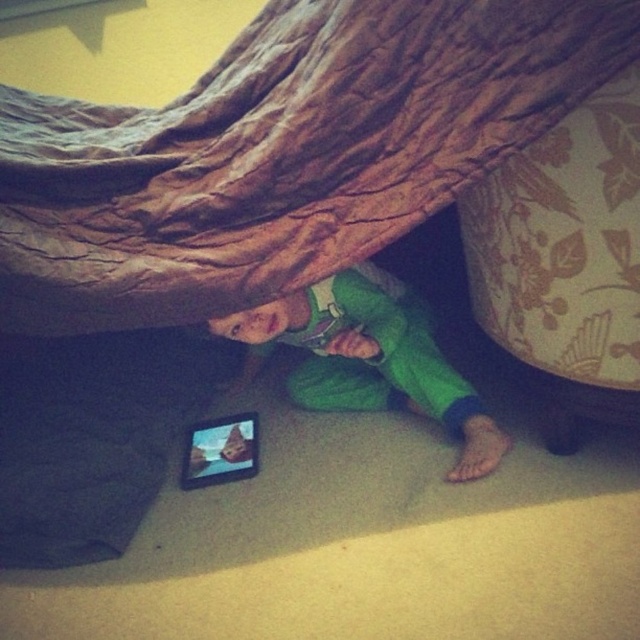
Question: Which of the following is the closest to the observer?

Choices:
 (A) (616, 65)
 (B) (337, 380)

Answer: (A)

Question: Is brown textured blanket at upper center thinner than green fleece pants at lower center?

Choices:
 (A) yes
 (B) no

Answer: (B)

Question: Among these objects, which one is farthest from the camera?

Choices:
 (A) green fleece pants at lower center
 (B) matte black tablet at lower center
 (C) brown textured blanket at upper center

Answer: (B)

Question: Does brown textured blanket at upper center have a smaller size compared to green fleece pants at lower center?

Choices:
 (A) yes
 (B) no

Answer: (B)

Question: Is brown textured blanket at upper center thinner than green fleece pants at lower center?

Choices:
 (A) no
 (B) yes

Answer: (A)

Question: Estimate the real-world distances between objects in this image. Which object is closer to the green fleece pants at lower center?

Choices:
 (A) matte black tablet at lower center
 (B) brown textured blanket at upper center

Answer: (A)